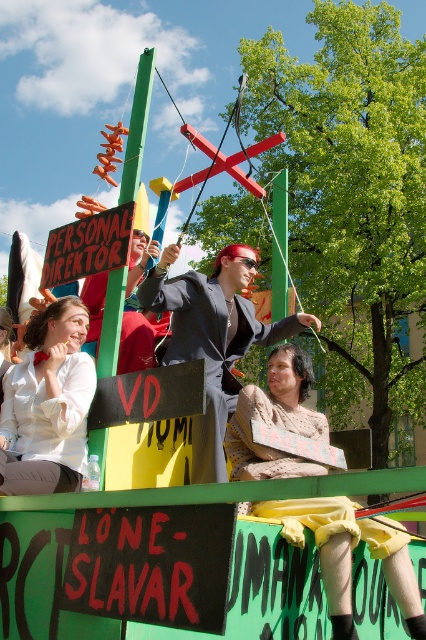
You are a photographer trying to capture a clear photo of both the white matte shirt at upper left and the shiny black suit at center. Based on their heights, which one should you focus on first to ensure both are in frame?

The white matte shirt at upper left is not as tall as the shiny black suit at center. To ensure both are in frame, focus on the shiny black suit at center first since it is taller and will occupy more of the photo space.

You are a photographer at the protest scene. You want to take a photo that includes both the white matte shirt at upper left and the shiny black suit at center. Based on their positions, which one should be placed on the left side of the photo?

The white matte shirt at upper left should be placed on the left side of the photo because it is positioned to the left of the shiny black suit at center in the scene.